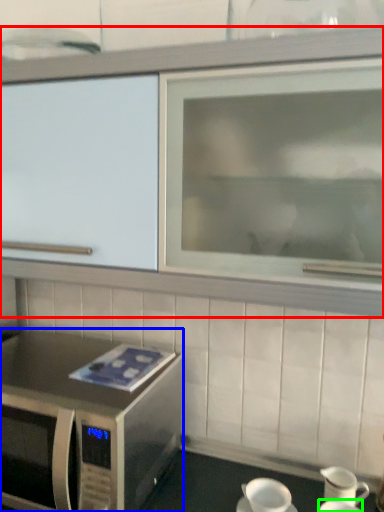
Question: Which object is positioned farthest from cabinetry (highlighted by a red box)? Select from microwave oven (highlighted by a blue box) and tableware (highlighted by a green box).

Choices:
 (A) microwave oven
 (B) tableware

Answer: (B)